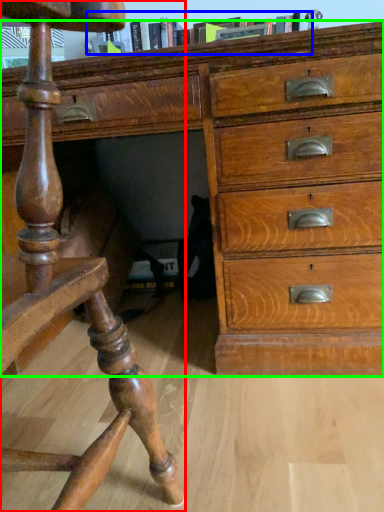
Question: Which object is the closest to the furniture (highlighted by a red box)? Choose among these: book (highlighted by a blue box) or chest of drawers (highlighted by a green box).

Choices:
 (A) book
 (B) chest of drawers

Answer: (B)